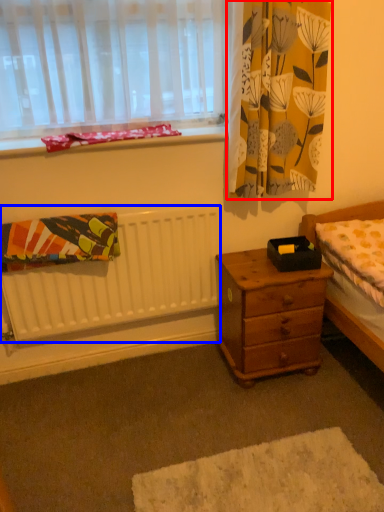
Question: Which point is further to the camera, curtain (highlighted by a red box) or radiator (highlighted by a blue box)?

Choices:
 (A) curtain
 (B) radiator

Answer: (B)